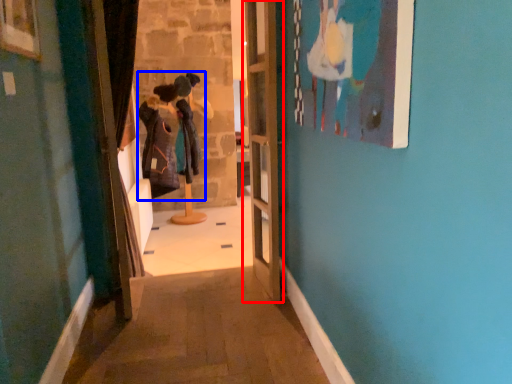
Question: Which object appears farthest to the camera in this image, door (highlighted by a red box) or couple (highlighted by a blue box)?

Choices:
 (A) door
 (B) couple

Answer: (B)